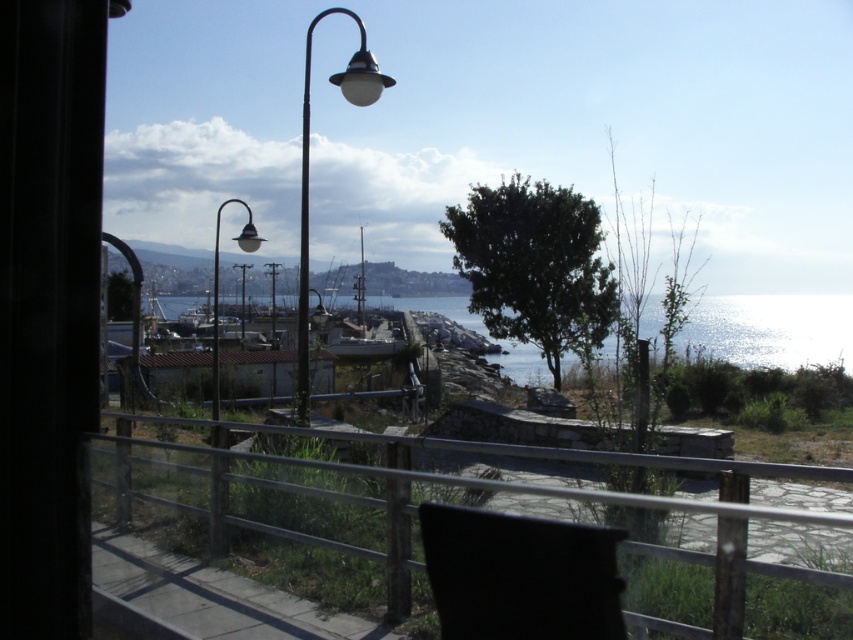
Question: Which point is closer to the camera?

Choices:
 (A) (213, 332)
 (B) (509, 541)
 (C) (271, 282)

Answer: (B)

Question: Which point is closer to the camera?

Choices:
 (A) (306, 209)
 (B) (828, 358)
 (C) (241, 339)
 (D) (216, 300)

Answer: (A)

Question: Which of the following is the closest to the observer?

Choices:
 (A) coord(387,340)
 (B) coord(766,570)

Answer: (B)

Question: Can you confirm if black plastic chair at lower center is positioned below metallic street light at center?

Choices:
 (A) yes
 (B) no

Answer: (A)

Question: Can you confirm if black plastic chair at lower center is positioned above clear blue water at center?

Choices:
 (A) no
 (B) yes

Answer: (A)

Question: Does metallic street light at left have a smaller size compared to metallic street light at center?

Choices:
 (A) yes
 (B) no

Answer: (B)